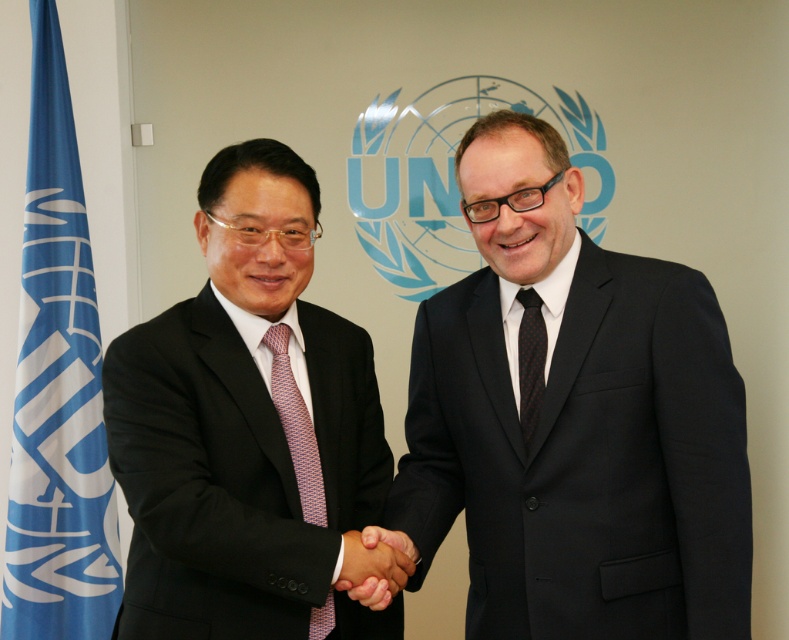
Does pink dotted tie at center have a greater height compared to black dotted tie at center?

Yes.

Describe the element at coordinates (294, 426) in the screenshot. I see `pink dotted tie at center` at that location.

Find the location of `pink dotted tie at center`. pink dotted tie at center is located at coordinates (294, 426).

Can you confirm if black matte suit at center is positioned above blue fabric flag at left?

No, black matte suit at center is not above blue fabric flag at left.

Who is positioned more to the right, black matte suit at center or blue fabric flag at left?

Positioned to the right is black matte suit at center.

This screenshot has height=640, width=789. What do you see at coordinates (574, 420) in the screenshot?
I see `black matte suit at center` at bounding box center [574, 420].

I want to click on black matte suit at center, so click(x=574, y=420).

What do you see at coordinates (245, 428) in the screenshot? I see `matte black suit at left` at bounding box center [245, 428].

Which is in front, point (211, 456) or point (535, 364)?

Point (211, 456) is more forward.

You are a GUI agent. You are given a task and a screenshot of the screen. Output one action in this format:
    pyautogui.click(x=<x>, y=<y>)
    Task: Click on the matte black suit at left
    
    Given the screenshot: What is the action you would take?
    pyautogui.click(x=245, y=428)